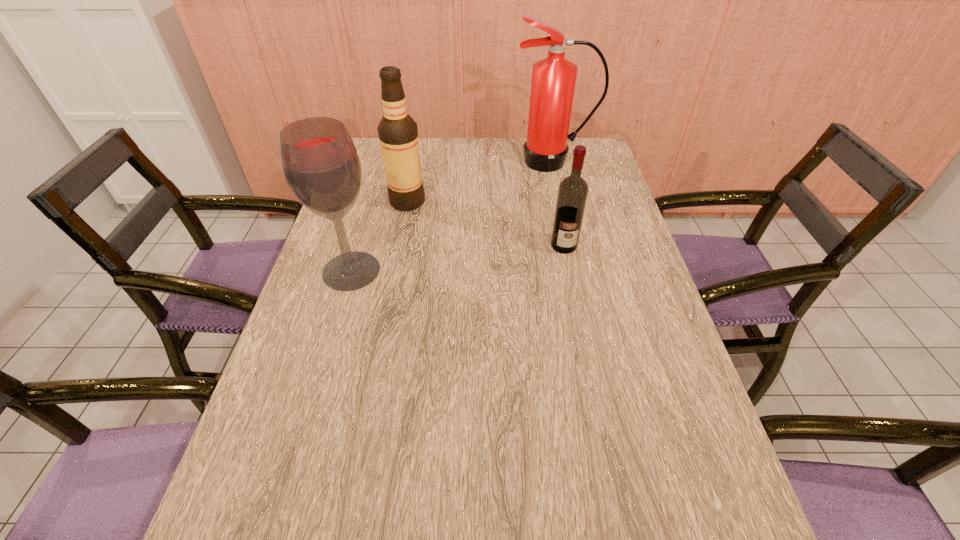
The image size is (960, 540). I want to click on the farthest object, so click(553, 82).

Identify the location of the farthest alcohol. The width and height of the screenshot is (960, 540). (398, 134).

Find the location of a particular element. This screenshot has width=960, height=540. the rightmost alcohol is located at coordinates (572, 194).

This screenshot has width=960, height=540. I want to click on the shortest alcohol, so click(x=572, y=194).

The height and width of the screenshot is (540, 960). What are the coordinates of `free space located at the spray nozzle of the farthest object` in the screenshot? It's located at (572, 245).

This screenshot has width=960, height=540. I want to click on vacant space located on the label of the second farthest object, so click(515, 201).

Locate an element on the screen. The height and width of the screenshot is (540, 960). vacant space located 0.260m on the front and back of the shortest object is located at coordinates (581, 329).

Image resolution: width=960 pixels, height=540 pixels. In order to click on object located in the far edge section of the desktop in this screenshot , I will do `click(553, 82)`.

Locate an element on the screen. The width and height of the screenshot is (960, 540). fire extinguisher located in the right edge section of the desktop is located at coordinates (553, 82).

This screenshot has width=960, height=540. I want to click on alcohol at the right edge, so click(572, 194).